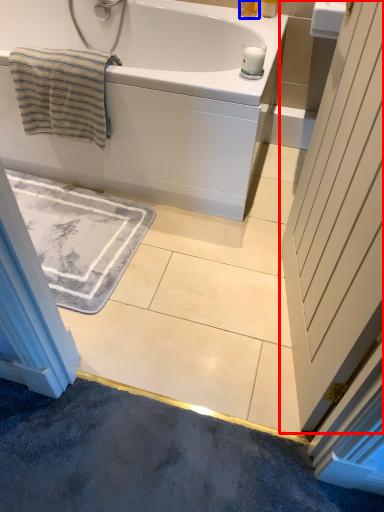
Question: Which object is closer to the camera taking this photo, door (highlighted by a red box) or toiletry (highlighted by a blue box)?

Choices:
 (A) door
 (B) toiletry

Answer: (A)